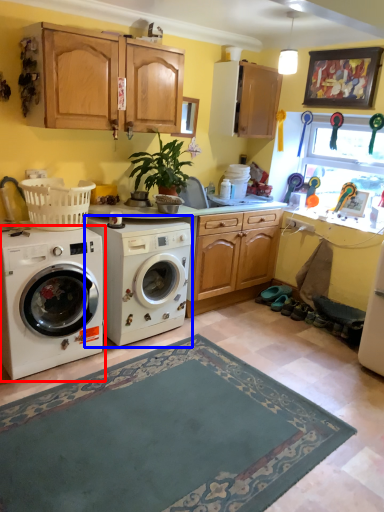
Question: Which point is further to the camera, washing machine (highlighted by a red box) or washing machine (highlighted by a blue box)?

Choices:
 (A) washing machine
 (B) washing machine

Answer: (B)